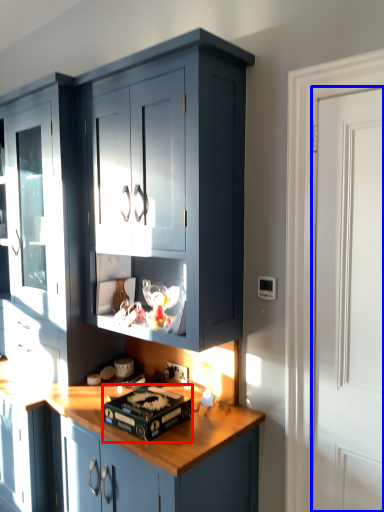
Question: Which object appears farthest to the camera in this image, appliance (highlighted by a red box) or door (highlighted by a blue box)?

Choices:
 (A) appliance
 (B) door

Answer: (A)